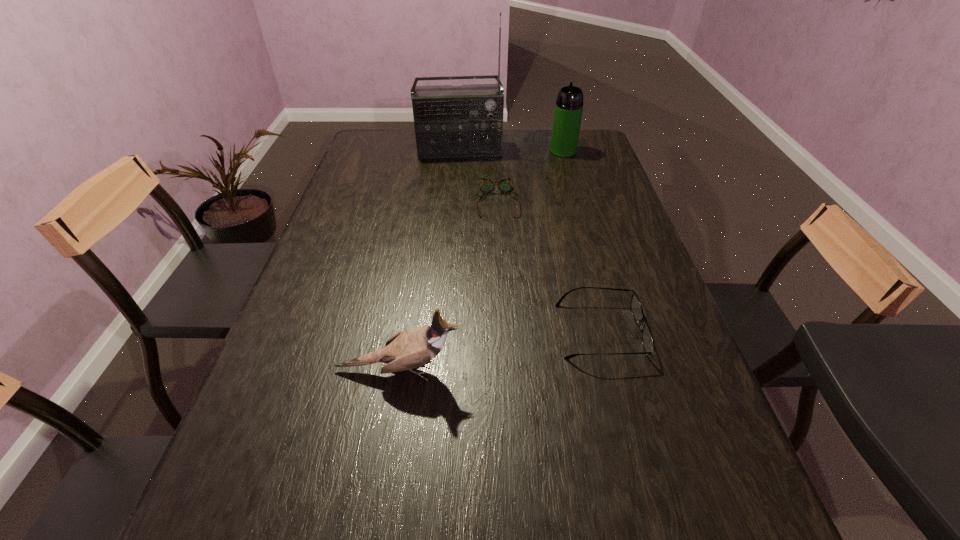
This screenshot has width=960, height=540. Find the location of `bird`. bird is located at coordinates (408, 349).

Locate an element on the screen. This screenshot has width=960, height=540. the right spectacles is located at coordinates (636, 308).

Locate an element on the screen. the left spectacles is located at coordinates (506, 185).

Where is `the third farthest object`? The height and width of the screenshot is (540, 960). the third farthest object is located at coordinates (506, 185).

Find the location of a particular element. radio receiver is located at coordinates (450, 121).

At what (x,y) coordinates should I click in order to perform the action: click on the fourth shortest object. Please return your answer as a coordinate pair (x, y). Looking at the image, I should click on click(x=569, y=105).

The image size is (960, 540). Find the location of `free space located at the face of the third shortest object`. free space located at the face of the third shortest object is located at coordinates (551, 369).

The width and height of the screenshot is (960, 540). Identify the location of free location located 0.070m on the front-facing side of the right spectacles. point(673,331).

The width and height of the screenshot is (960, 540). I want to click on free space located on the front-facing side of the farther spectacles, so click(x=498, y=237).

Identify the location of vacant point located 0.180m on the front-facing side of the farther spectacles. point(499,257).